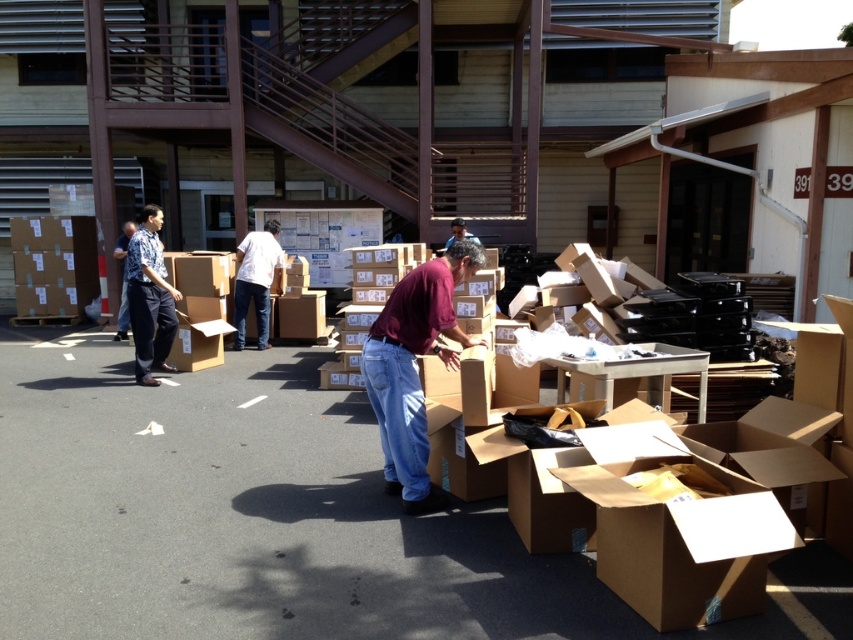
Is maroon shirt at center further to camera compared to matte brown shirt at center?

No, maroon shirt at center is closer to the viewer.

Is maroon shirt at center wider than matte brown shirt at center?

Yes.

Is point (426, 316) less distant than point (451, 220)?

That is True.

At what (x,y) coordinates should I click in order to perform the action: click on maroon shirt at center. Please return your answer as a coordinate pair (x, y). This screenshot has height=640, width=853. Looking at the image, I should click on (415, 368).

Does point (242, 257) come behind point (459, 228)?

No, (242, 257) is in front of (459, 228).

Between point (267, 224) and point (456, 237), which one is positioned behind?

Point (456, 237)

Locate an element on the screen. The width and height of the screenshot is (853, 640). jeans at center is located at coordinates (256, 280).

Who is taller, blue shirt at left or matte brown shirt at center?

blue shirt at left

Does blue shirt at left have a greater width compared to matte brown shirt at center?

Indeed, blue shirt at left has a greater width compared to matte brown shirt at center.

Is point (126, 220) positioned behind point (450, 244)?

Yes, it is.

Where is `blue shirt at left`? Image resolution: width=853 pixels, height=640 pixels. blue shirt at left is located at coordinates (123, 278).